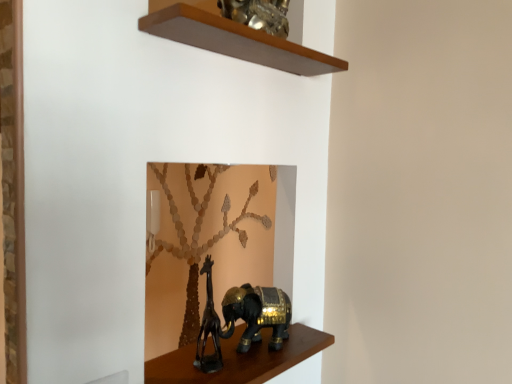
Find the location of `free space underneath wooden shelf at upper center, placed as the 1th shelf when sorted from top to bottom (from a real-world perspective)`. free space underneath wooden shelf at upper center, placed as the 1th shelf when sorted from top to bottom (from a real-world perspective) is located at coordinates (263, 360).